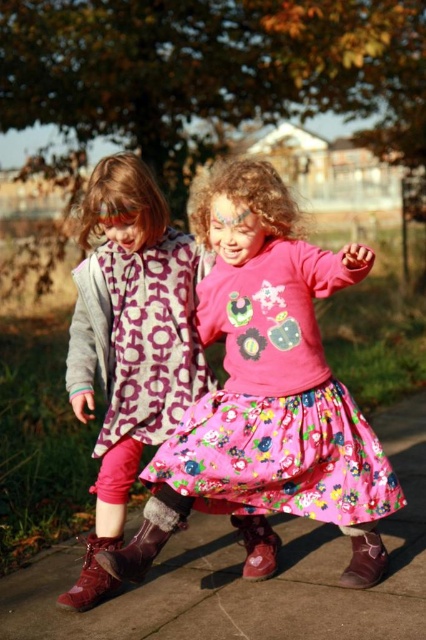
You are a photographer trying to capture the best shot of the children. You notice a point at coordinates (250, 582) in the image. Based on the scene description, what object is located at that point?

The point at coordinates (250, 582) marks the pink fabric skirt at lower center belonging to the child on the right.

You are a photographer trying to capture the children in the scene. You notice the pink floral dress at center and the brown suede boot at lower left. Which object should you focus on first if you want to photograph the one that is higher up in the image?

The pink floral dress at center is located above the brown suede boot at lower left, so you should focus on the pink floral dress at center first to capture the higher object.

You are a photographer trying to capture a photo of the children. You notice the floral cotton dress at center and the brown suede boot at lower center. Which object should you focus on if you want to capture the one that is positioned to the right side of the other?

The floral cotton dress at center is to the right of the brown suede boot at lower center, so you should focus on the floral cotton dress at center to capture the one positioned to the right.